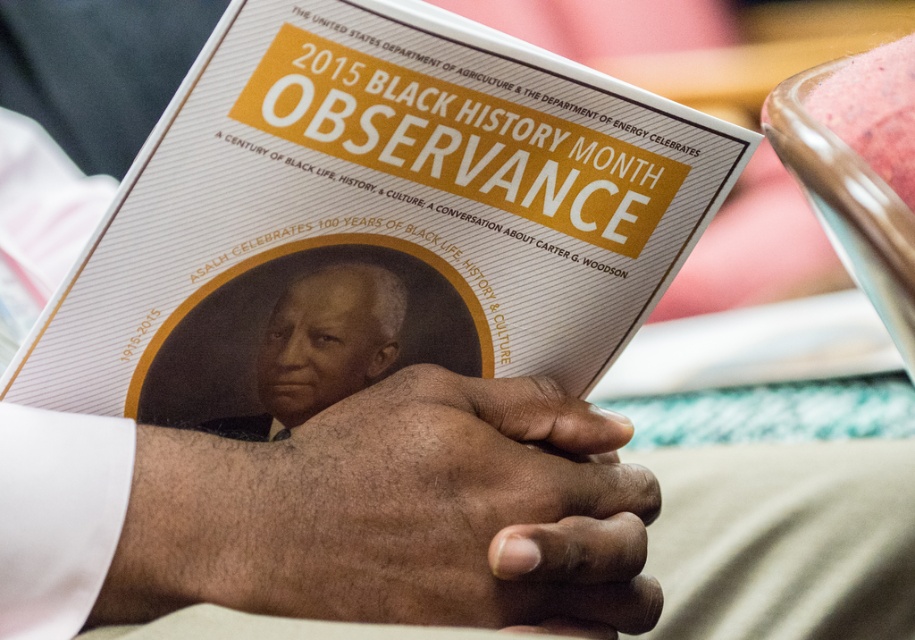
In the scene shown: Can you confirm if dark skin/hairy hands at center is shorter than smooth black portrait at center?

No, dark skin/hairy hands at center is not shorter than smooth black portrait at center.

Is dark skin/hairy hands at center thinner than smooth black portrait at center?

No.

Looking at this image, who is more distant from viewer, [498,602] or [288,371]?

The point [288,371] is more distant.

Locate an element on the screen. dark skin/hairy hands at center is located at coordinates (472, 513).

Is matte paper booklet at center below smooth black portrait at center?

No, matte paper booklet at center is not below smooth black portrait at center.

How far apart are matte paper booklet at center and smooth black portrait at center?

The distance of matte paper booklet at center from smooth black portrait at center is 2.69 inches.

Where is `matte paper booklet at center`? The height and width of the screenshot is (640, 915). matte paper booklet at center is located at coordinates (377, 204).

Can you confirm if matte paper booklet at center is positioned to the left of dark skin/hairy hands at center?

Yes, matte paper booklet at center is to the left of dark skin/hairy hands at center.

Who is more forward, (445, 252) or (327, 488)?

Point (327, 488)

At what (x,y) coordinates should I click in order to perform the action: click on matte paper booklet at center. Please return your answer as a coordinate pair (x, y). This screenshot has width=915, height=640. Looking at the image, I should click on (377, 204).